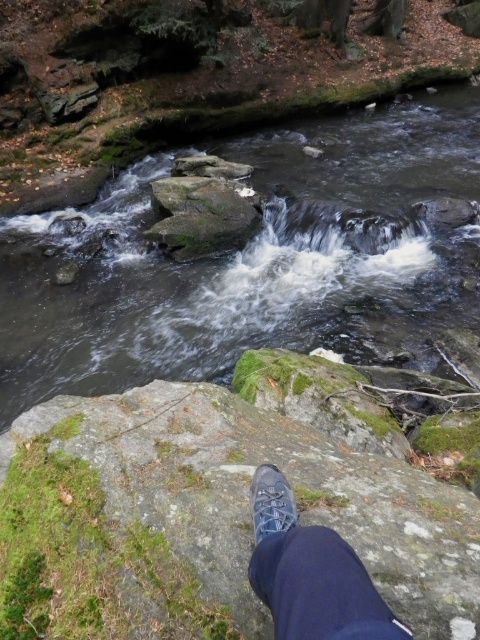
You are trying to cross the stream safely. The smooth gray rock at center and the blue suede shoe at lower center are in your path. Which object should you avoid stepping on to ensure stability?

You should avoid stepping on the blue suede shoe at lower center because the smooth gray rock at center is larger and provides a more stable footing compared to the smaller blue suede shoe at lower center.

Consider the image. You are standing at the point labeled point (144, 214) and want to cross the stream to the other side. The stream is flowing swiftly with white frothy waves. Can you safely cross the stream at this point?

The point labeled point (144, 214) is 7.99 meters away from the viewer. However, the stream at this point has swift, turbulent water with white frothy waves, making it unsafe to cross due to the strong current and potential hidden obstacles.

You are standing at the edge of the stream and want to place a small pebble on one of the two points marked in the image. Which point, point (299, 547) or point (278, 504), is closer to you where you can easily reach it without moving your position?

Point (299, 547) is closer to the viewer than point (278, 504), so you can easily reach it without moving your position.